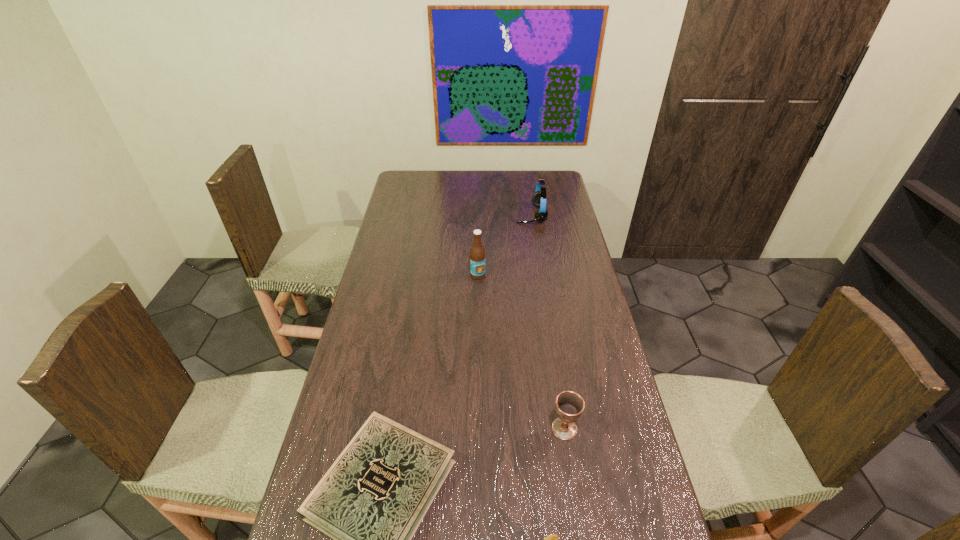
Image resolution: width=960 pixels, height=540 pixels. Identify the location of headset situated at the right edge. pyautogui.click(x=539, y=197).

The height and width of the screenshot is (540, 960). Find the location of `chalice present at the right edge`. chalice present at the right edge is located at coordinates (569, 405).

This screenshot has width=960, height=540. Identify the location of vacant space at the far edge of the desktop. (446, 185).

Identify the location of vacant space at the left edge of the desktop. The height and width of the screenshot is (540, 960). (397, 259).

Locate an element on the screen. This screenshot has height=540, width=960. free location at the right edge of the desktop is located at coordinates (556, 200).

You are a GUI agent. You are given a task and a screenshot of the screen. Output one action in this format:
    pyautogui.click(x=<x>, y=<y>)
    Task: Click on the blank space at the far left corner
    
    Given the screenshot: What is the action you would take?
    pyautogui.click(x=401, y=185)

The width and height of the screenshot is (960, 540). Find the location of `vacant point located between the chalice and the headset`. vacant point located between the chalice and the headset is located at coordinates (547, 322).

Select which object is the third closest to the duckling. Please provide its 2D coordinates. Your answer should be formatted as a tuple, i.e. [(x, y)], where the tuple contains the x and y coordinates of a point satisfying the conditions above.

[(477, 253)]

Locate which object ranks fourth in proximity to the headset. Please provide its 2D coordinates. Your answer should be formatted as a tuple, i.e. [(x, y)], where the tuple contains the x and y coordinates of a point satisfying the conditions above.

[(552, 539)]

Where is `vacant position in the image that satisfies the following two spatial constraints: 1. with the microphone attached to the side of the farthest object; 2. on the front side of the chalice`? vacant position in the image that satisfies the following two spatial constraints: 1. with the microphone attached to the side of the farthest object; 2. on the front side of the chalice is located at coordinates (564, 429).